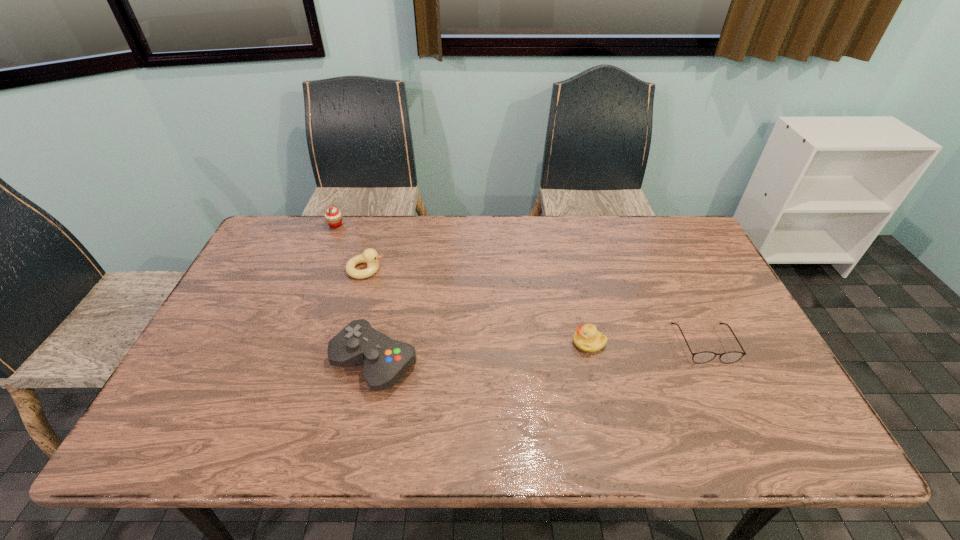
The image size is (960, 540). In order to click on free space at the near edge of the desktop in this screenshot , I will do `click(655, 420)`.

At what (x,y) coordinates should I click in order to perform the action: click on blank space at the left edge. Please return your answer as a coordinate pair (x, y). The height and width of the screenshot is (540, 960). Looking at the image, I should click on (288, 265).

This screenshot has height=540, width=960. In the image, there is a desktop. In order to click on vacant space at the right edge in this screenshot , I will do `click(699, 269)`.

Where is `free region at the far left corner`? The height and width of the screenshot is (540, 960). free region at the far left corner is located at coordinates (277, 222).

Locate an element on the screen. This screenshot has height=540, width=960. free space at the far right corner of the desktop is located at coordinates (651, 218).

Identify the location of vacant region at the near right corner of the desktop. The image size is (960, 540). (742, 426).

Image resolution: width=960 pixels, height=540 pixels. I want to click on empty space that is in between the taller duckling and the cupcake, so click(x=350, y=247).

Identify the location of free space that is in between the farther duckling and the fourth object from left to right. The height and width of the screenshot is (540, 960). (477, 306).

At what (x,y) coordinates should I click in order to perform the action: click on empty location between the nearer duckling and the rightmost object. Please return your answer as a coordinate pair (x, y). This screenshot has height=540, width=960. Looking at the image, I should click on (646, 343).

At what (x,y) coordinates should I click in order to perform the action: click on free space between the shorter duckling and the left duckling. Please return your answer as a coordinate pair (x, y). This screenshot has width=960, height=540. Looking at the image, I should click on (477, 306).